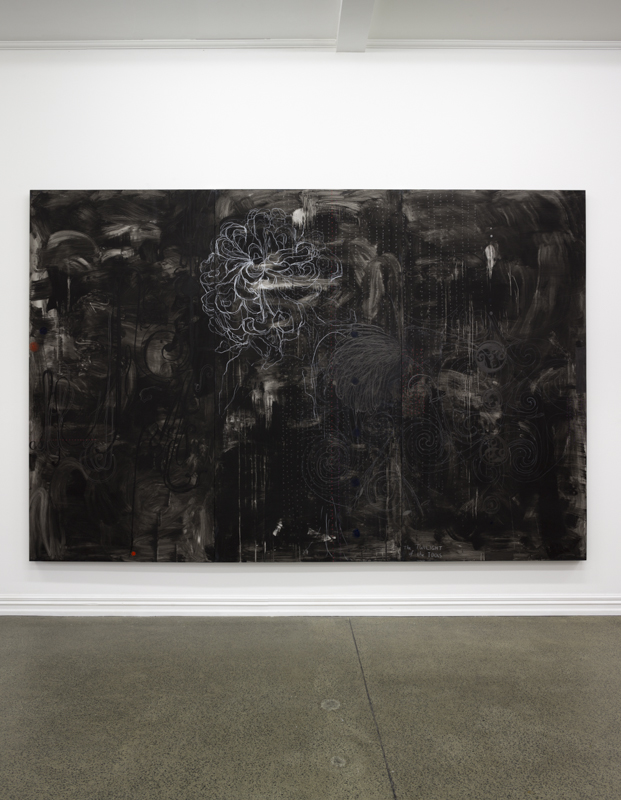
You are a GUI agent. You are given a task and a screenshot of the screen. Output one action in this format:
    pyautogui.click(x=<x>, y=<y>)
    Task: Click on the cement floor
    
    Given the screenshot: What is the action you would take?
    pyautogui.click(x=204, y=658)